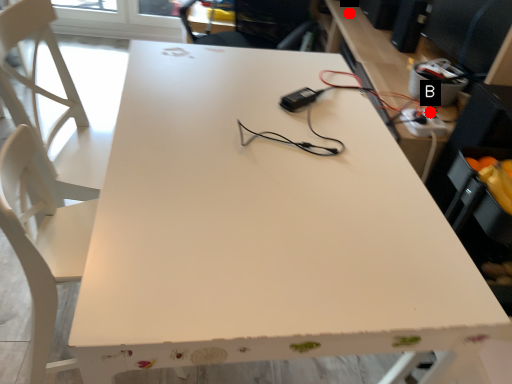
Question: Two points are circled on the image, labeled by A and B beside each circle. Which point appears farthest from the camera in this image?

Choices:
 (A) A is further
 (B) B is further

Answer: (A)